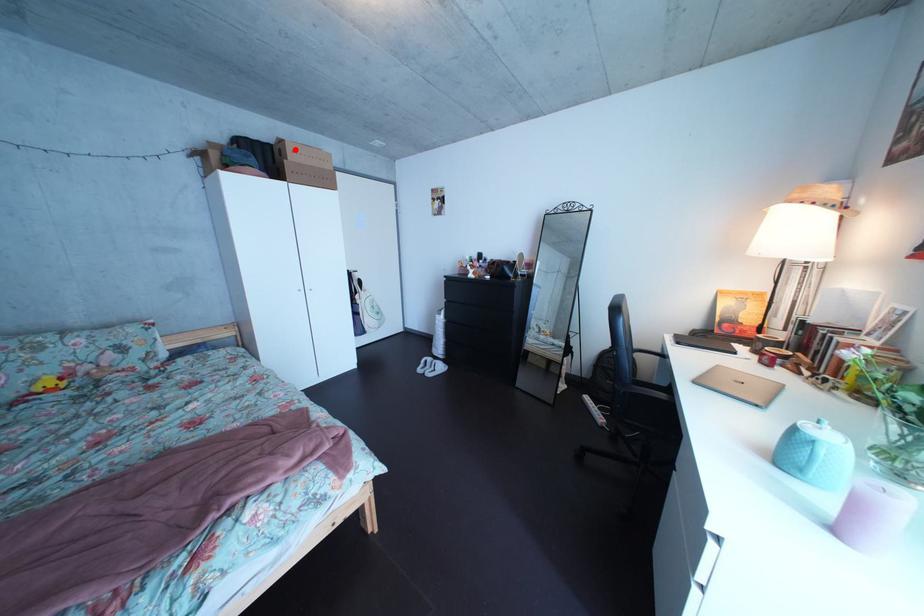
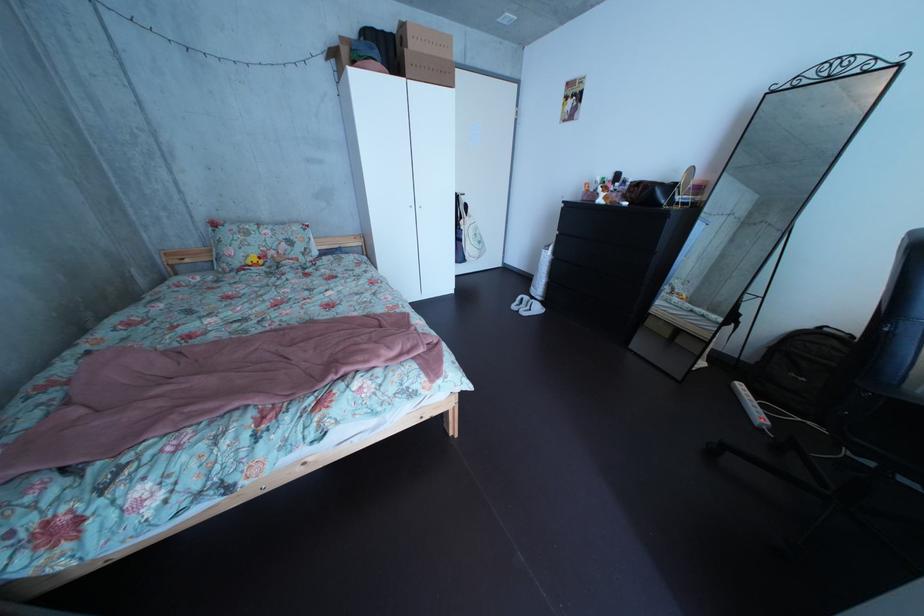
Find the pixel in the second image that matches the highlighted location in the first image.

(418, 34)